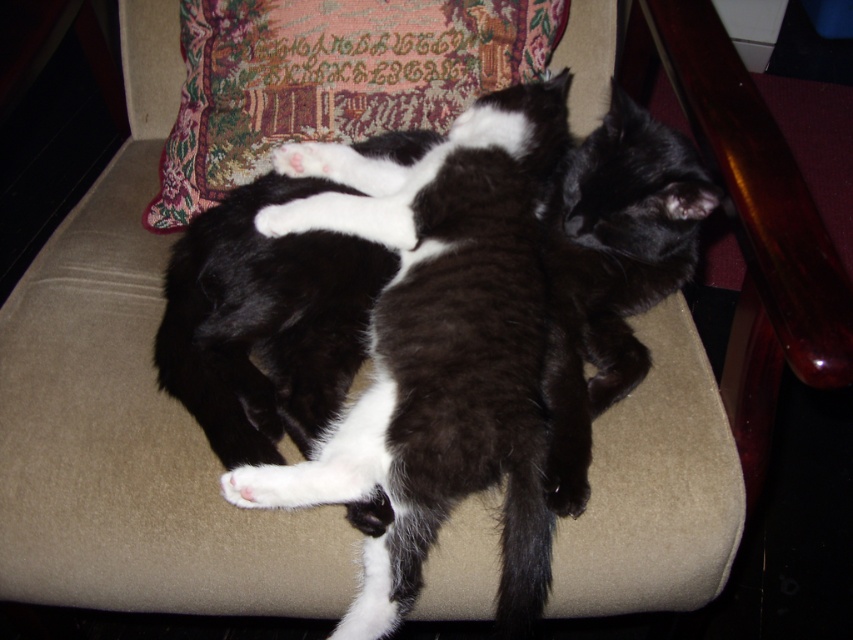
How much distance is there between soft fur cat at center and velvet cushion at upper center?

soft fur cat at center is 10.00 inches from velvet cushion at upper center.

Between soft fur cat at center and velvet cushion at upper center, which one is positioned lower?

soft fur cat at center is lower down.

What do you see at coordinates (437, 349) in the screenshot?
I see `soft fur cat at center` at bounding box center [437, 349].

The height and width of the screenshot is (640, 853). What are the coordinates of `soft fur cat at center` in the screenshot? It's located at (437, 349).